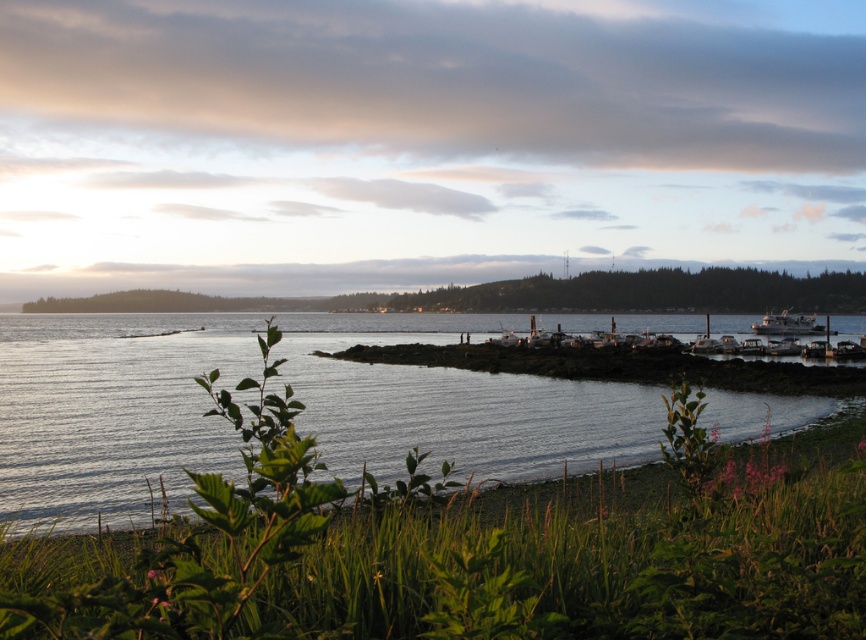
Looking at this image, you are standing at the point marked by the coordinates point [113,410]. Looking around, you see clear water at lower center. Which direction should you walk to reach the clear water at lower center?

Since you are already at the point marked by the coordinates point [113,410], which marks the clear water at lower center, you are already at the clear water at lower center.

You are a photographer planning to capture the reflection of the white matte boat at right in the clear water at lower center. Based on the scene, will the boat be fully visible in the reflection?

The clear water at lower center is larger in size than the white matte boat at right, so the reflection of the white matte boat at right should be fully visible in the clear water at lower center.